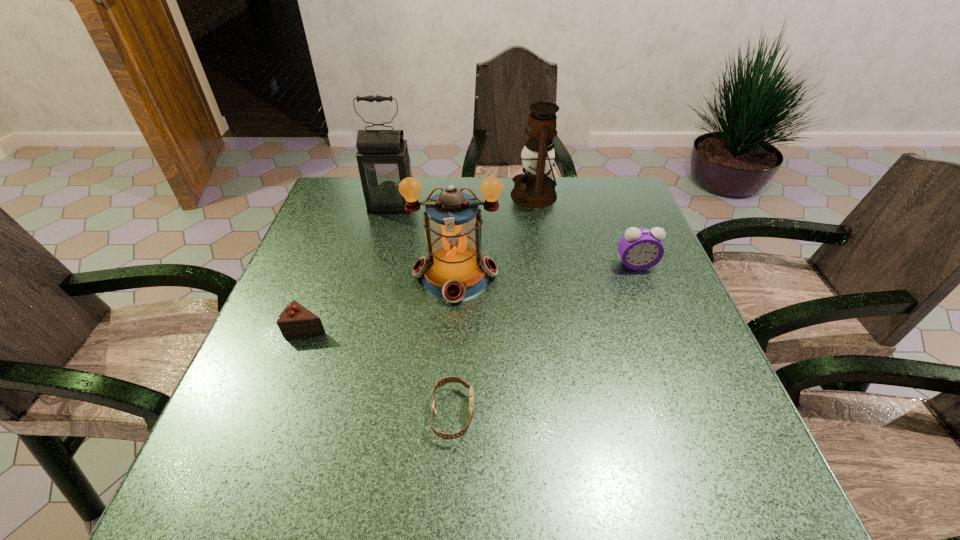
Locate an element on the screen. The height and width of the screenshot is (540, 960). the fifth object from left to right is located at coordinates (534, 189).

Locate an element on the screen. This screenshot has height=540, width=960. the leftmost lantern is located at coordinates (383, 160).

You are a GUI agent. You are given a task and a screenshot of the screen. Output one action in this format:
    pyautogui.click(x=<x>, y=<y>)
    Task: Click on the nearest lantern
    
    Given the screenshot: What is the action you would take?
    pyautogui.click(x=455, y=269)

The height and width of the screenshot is (540, 960). I want to click on the second lantern from left to right, so click(x=455, y=269).

Where is `the rightmost object`? the rightmost object is located at coordinates (640, 248).

The image size is (960, 540). What are the coordinates of `alarm clock` in the screenshot? It's located at (640, 248).

The height and width of the screenshot is (540, 960). Identify the location of the fifth farthest object. (295, 320).

Image resolution: width=960 pixels, height=540 pixels. Identify the location of chocolate cake. (295, 320).

Locate an element on the screen. The image size is (960, 540). watch is located at coordinates (442, 381).

Locate an element on the screen. This screenshot has width=960, height=540. the nearest object is located at coordinates (442, 381).